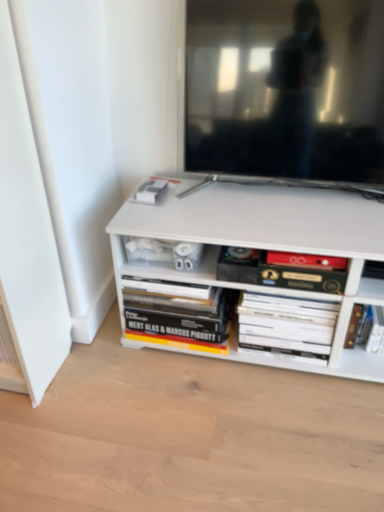
Question: Is hardcover book at center, which is the 2th book from left to right, facing towards hardcover book at lower right, which is the 1th book in right-to-left order?

Choices:
 (A) yes
 (B) no

Answer: (B)

Question: From a real-world perspective, is hardcover book at center, which is the 2th book from left to right, beneath hardcover book at lower right, positioned as the 4th book in left-to-right order?

Choices:
 (A) no
 (B) yes

Answer: (A)

Question: Is hardcover book at center, which is the 2th book from left to right, smaller than hardcover book at lower right, positioned as the 4th book in left-to-right order?

Choices:
 (A) yes
 (B) no

Answer: (B)

Question: Can you confirm if hardcover book at center, which is the third book in right-to-left order, is taller than hardcover book at lower right, which is the 1th book in right-to-left order?

Choices:
 (A) yes
 (B) no

Answer: (B)

Question: Considering the relative sizes of hardcover book at center, which is the 2th book from left to right, and hardcover book at lower right, which is the 1th book in right-to-left order, in the image provided, is hardcover book at center, which is the 2th book from left to right, shorter than hardcover book at lower right, which is the 1th book in right-to-left order,?

Choices:
 (A) yes
 (B) no

Answer: (A)

Question: Is hardcover book at lower right, positioned as the 4th book in left-to-right order, bigger or smaller than white matte book at center, which is the 2th book from right to left?

Choices:
 (A) small
 (B) big

Answer: (A)

Question: Considering the positions of hardcover book at lower right, which is the 1th book in right-to-left order, and white matte book at center, which is the 2th book from right to left, in the image, is hardcover book at lower right, which is the 1th book in right-to-left order, wider or thinner than white matte book at center, which is the 2th book from right to left,?

Choices:
 (A) wide
 (B) thin

Answer: (B)

Question: Is hardcover book at lower right, positioned as the 4th book in left-to-right order, taller or shorter than white matte book at center, the third book positioned from the left?

Choices:
 (A) tall
 (B) short

Answer: (B)

Question: In the image, is hardcover book at lower right, positioned as the 4th book in left-to-right order, positioned in front of or behind white matte book at center, which is the 2th book from right to left?

Choices:
 (A) front
 (B) behind

Answer: (B)

Question: In terms of height, does hardcover book at lower center, which is the 1th book from left to right, look taller or shorter compared to white matte book at center, which is the 2th book from right to left?

Choices:
 (A) tall
 (B) short

Answer: (B)

Question: Is hardcover book at lower center, which is the fourth book in right-to-left order, in front of or behind white matte book at center, which is the 2th book from right to left, in the image?

Choices:
 (A) behind
 (B) front

Answer: (A)

Question: Considering the positions of hardcover book at lower center, which is the 1th book from left to right, and white matte book at center, which is the 2th book from right to left, in the image, is hardcover book at lower center, which is the 1th book from left to right, bigger or smaller than white matte book at center, which is the 2th book from right to left,?

Choices:
 (A) big
 (B) small

Answer: (A)

Question: From the image's perspective, is hardcover book at lower center, which is the 1th book from left to right, positioned above or below white matte book at center, which is the 2th book from right to left?

Choices:
 (A) below
 (B) above

Answer: (B)

Question: Based on their sizes in the image, would you say white matte book at center, the third book positioned from the left, is bigger or smaller than hardcover book at lower center, which is the fourth book in right-to-left order?

Choices:
 (A) small
 (B) big

Answer: (A)

Question: From a real-world perspective, is white matte book at center, which is the 2th book from right to left, above or below hardcover book at lower center, which is the fourth book in right-to-left order?

Choices:
 (A) below
 (B) above

Answer: (B)